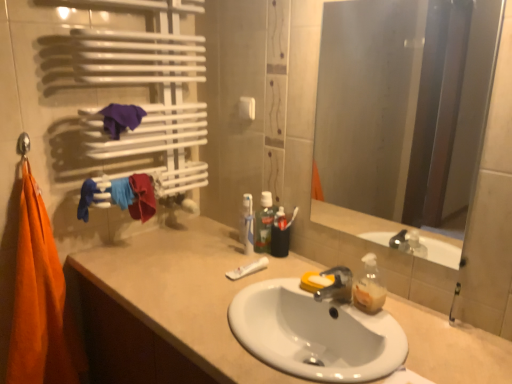
I want to click on empty space that is ontop of beige matte cabinet at lower left (from a real-world perspective), so click(228, 288).